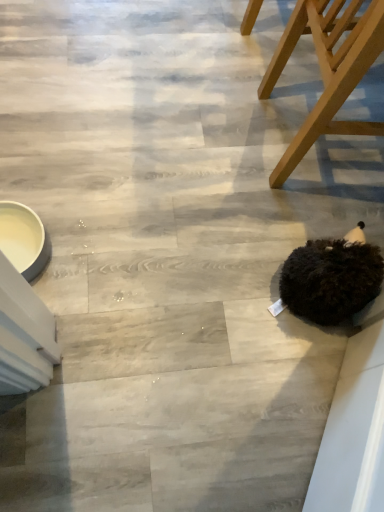
Image resolution: width=384 pixels, height=512 pixels. What do you see at coordinates (331, 280) in the screenshot?
I see `black fuzzy ball at lower right` at bounding box center [331, 280].

Identify the location of black fuzzy ball at lower right. (331, 280).

Measure the distance between black fuzzy ball at lower right and camera.

black fuzzy ball at lower right is 33.45 inches from camera.

The width and height of the screenshot is (384, 512). Describe the element at coordinates (328, 70) in the screenshot. I see `wooden chair at upper right` at that location.

Identify the location of wooden chair at upper right. pyautogui.click(x=328, y=70).

Locate an element on the screen. black fuzzy ball at lower right is located at coordinates (331, 280).

Can you confirm if black fuzzy ball at lower right is positioned to the left of wooden chair at upper right?

Correct, you'll find black fuzzy ball at lower right to the left of wooden chair at upper right.

In the scene shown: Between black fuzzy ball at lower right and wooden chair at upper right, which one is positioned behind?

black fuzzy ball at lower right.

Is point (322, 296) closer or farther from the camera than point (308, 128)?

Point (322, 296) is positioned closer to the camera compared to point (308, 128).

From the image's perspective, who appears lower, black fuzzy ball at lower right or wooden chair at upper right?

black fuzzy ball at lower right.

From a real-world perspective, is black fuzzy ball at lower right located higher than wooden chair at upper right?

No, from a real-world perspective, black fuzzy ball at lower right is not above wooden chair at upper right.

From the picture: Is black fuzzy ball at lower right wider or thinner than wooden chair at upper right?

black fuzzy ball at lower right is thinner than wooden chair at upper right.

Which of these two, black fuzzy ball at lower right or wooden chair at upper right, stands taller?

Standing taller between the two is wooden chair at upper right.

Considering the sizes of objects black fuzzy ball at lower right and wooden chair at upper right in the image provided, who is bigger, black fuzzy ball at lower right or wooden chair at upper right?

With larger size is wooden chair at upper right.

In the scene shown: Is black fuzzy ball at lower right situated inside wooden chair at upper right or outside?

black fuzzy ball at lower right is located beyond the bounds of wooden chair at upper right.

Is there a large distance between black fuzzy ball at lower right and wooden chair at upper right?

That's not correct — black fuzzy ball at lower right is a little close to wooden chair at upper right.

In the scene shown: Is black fuzzy ball at lower right facing away from wooden chair at upper right?

black fuzzy ball at lower right is not turned away from wooden chair at upper right.

I want to click on animal behind the wooden chair at upper right, so click(331, 280).

Consider the image. Considering the positions of objects wooden chair at upper right and black fuzzy ball at lower right in the image provided, who is more to the left, wooden chair at upper right or black fuzzy ball at lower right?

black fuzzy ball at lower right is more to the left.

Which object is further away from the camera taking this photo, wooden chair at upper right or black fuzzy ball at lower right?

black fuzzy ball at lower right.

Which is behind, point (376, 8) or point (285, 298)?

The point (285, 298) is farther from the camera.

From the image's perspective, does wooden chair at upper right appear lower than black fuzzy ball at lower right?

No, from the image's perspective, wooden chair at upper right is not beneath black fuzzy ball at lower right.

From a real-world perspective, which is physically below, wooden chair at upper right or black fuzzy ball at lower right?

black fuzzy ball at lower right.

In terms of width, does wooden chair at upper right look wider or thinner when compared to black fuzzy ball at lower right?

wooden chair at upper right is wider than black fuzzy ball at lower right.

Considering the relative sizes of wooden chair at upper right and black fuzzy ball at lower right in the image provided, is wooden chair at upper right taller than black fuzzy ball at lower right?

Yes.

Considering the relative sizes of wooden chair at upper right and black fuzzy ball at lower right in the image provided, is wooden chair at upper right smaller than black fuzzy ball at lower right?

No, wooden chair at upper right is not smaller than black fuzzy ball at lower right.

Is wooden chair at upper right outside of black fuzzy ball at lower right?

Absolutely, wooden chair at upper right is external to black fuzzy ball at lower right.

Is there a large distance between wooden chair at upper right and black fuzzy ball at lower right?

wooden chair at upper right is near black fuzzy ball at lower right, not far away.

From the picture: Is wooden chair at upper right facing towards black fuzzy ball at lower right?

No, wooden chair at upper right does not turn towards black fuzzy ball at lower right.

How distant is wooden chair at upper right from black fuzzy ball at lower right?

wooden chair at upper right and black fuzzy ball at lower right are 14.16 inches apart.

This screenshot has height=512, width=384. I want to click on animal below the wooden chair at upper right (from the image's perspective), so click(x=331, y=280).

Identify the location of animal on the left of wooden chair at upper right. This screenshot has width=384, height=512. (331, 280).

The image size is (384, 512). Identify the location of animal below the wooden chair at upper right (from the image's perspective). (331, 280).